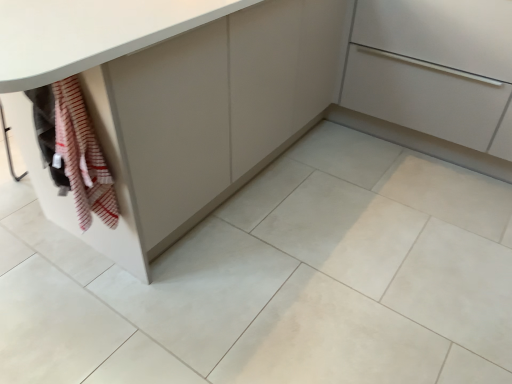
Identify the location of free spot above white glossy tile at lower left (from a real-world perspective). (52, 271).